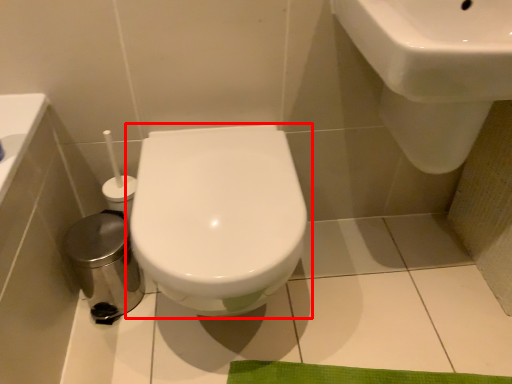
Question: Observing the image, what is the correct spatial positioning of toilet (annotated by the red box) in reference to sink?

Choices:
 (A) left
 (B) right

Answer: (A)